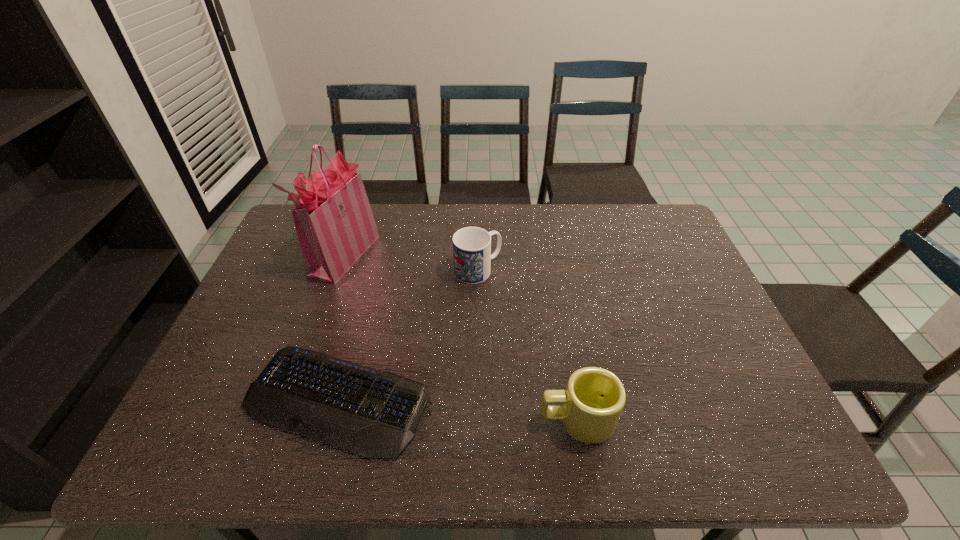
This screenshot has height=540, width=960. Find the location of `vacant space at the near edge of the desktop`. vacant space at the near edge of the desktop is located at coordinates (497, 438).

In the image, there is a desktop. Where is `vacant space at the left edge`? This screenshot has width=960, height=540. vacant space at the left edge is located at coordinates (228, 349).

In the image, there is a desktop. At what (x,y) coordinates should I click in order to perform the action: click on vacant space at the right edge. Please return your answer as a coordinate pair (x, y). The width and height of the screenshot is (960, 540). Looking at the image, I should click on (683, 342).

Where is `free space at the near left corner of the desktop`? This screenshot has height=540, width=960. free space at the near left corner of the desktop is located at coordinates (206, 441).

Locate an element on the screen. empty location between the right mug and the left mug is located at coordinates (527, 345).

The image size is (960, 540). In order to click on vacant area that lies between the rightmost object and the left mug in this screenshot , I will do `click(527, 345)`.

Find the location of a particular element. free space between the shortest object and the shopping bag is located at coordinates (342, 327).

The image size is (960, 540). What are the coordinates of `vacant space in between the right mug and the shortest object` in the screenshot? It's located at 457,410.

Where is `vacant area between the shortest object and the shopping bag`? vacant area between the shortest object and the shopping bag is located at coordinates (342, 327).

The width and height of the screenshot is (960, 540). In order to click on vacant space in between the nearer mug and the farther mug in this screenshot , I will do `click(527, 345)`.